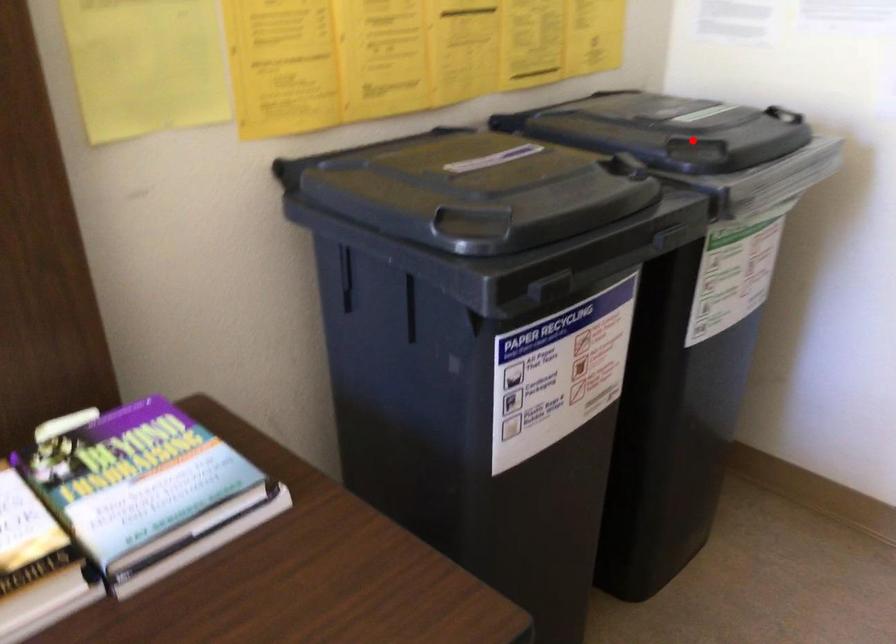
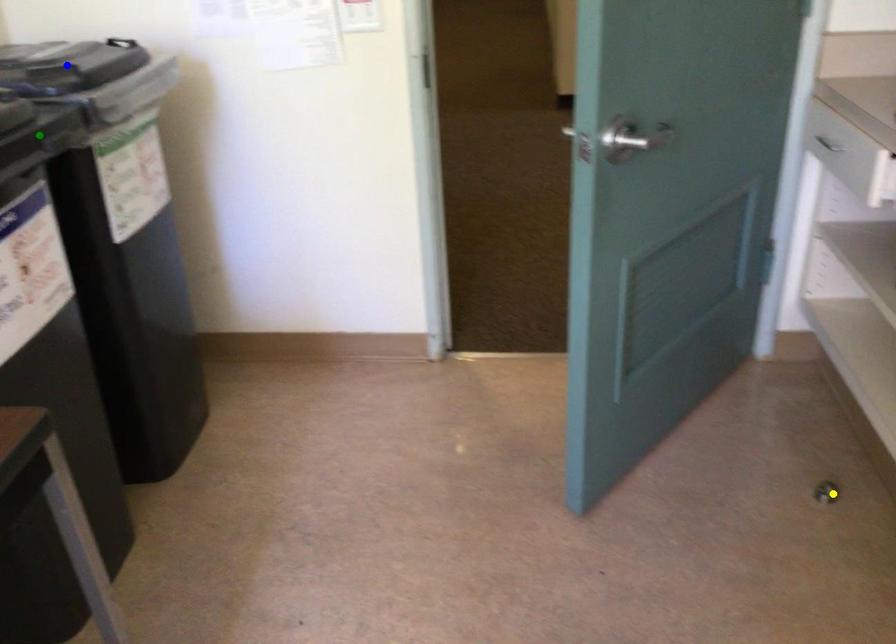
Question: I am providing you with two images of the same scene from different viewpoints. A red point is marked on the first image. You are given multiple points on the second image. Which mark in image 2 goes with the point in image 1?

Choices:
 (A) green point
 (B) blue point
 (C) yellow point

Answer: (B)